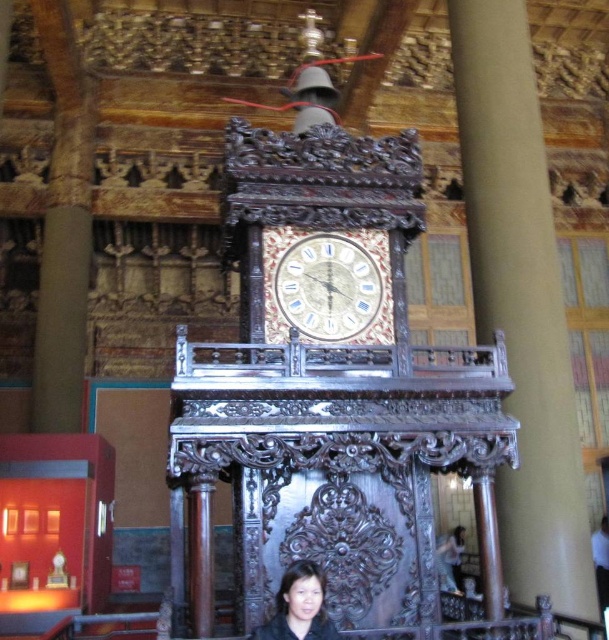
Based on the photo, you are an artist sketching the clock and notice the smooth black hair at lower center and the smooth beige shirt at lower right. Which object would you need to draw smaller in your sketch?

The smooth black hair at lower center needs to be drawn smaller in the sketch since it has a smaller size compared to the smooth beige shirt at lower right.

You are a painter standing at the base of the gold textured clock at center and want to paint the smooth black hair at lower center without moving your position. Can you reach it with your 1.5 meter long brush?

The gold textured clock at center and smooth black hair at lower center are 9.07 meters apart, so the 1.5 meter long brush is not long enough to reach the smooth black hair at lower center from the gold textured clock at center.

You are standing in front of the ornate wooden clock structure. There is a point marked at coordinates (328, 285). Can you tell me what this point is located on?

The point marked at coordinates (328, 285) is located on the gold textured clock at center.